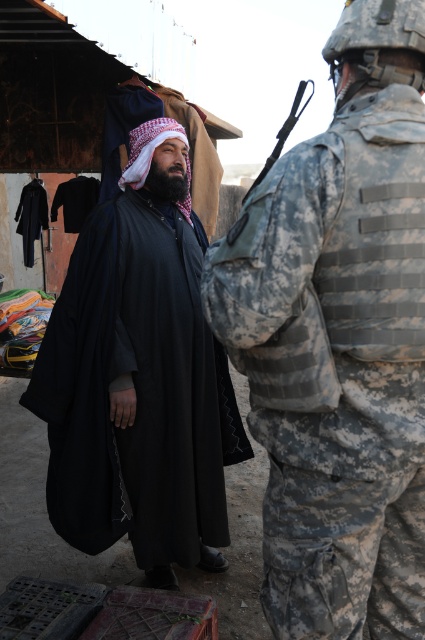
Question: Which of the following is the farthest from the observer?

Choices:
 (A) (368, 401)
 (B) (70, 522)

Answer: (B)

Question: Which of the following is the closest to the observer?

Choices:
 (A) black matte robe at center
 (B) camouflage uniform at right

Answer: (B)

Question: Is camouflage uniform at right to the right of black matte robe at center from the viewer's perspective?

Choices:
 (A) no
 (B) yes

Answer: (B)

Question: Can you confirm if camouflage uniform at right is positioned below black matte robe at center?

Choices:
 (A) yes
 (B) no

Answer: (B)

Question: Is camouflage uniform at right in front of black matte robe at center?

Choices:
 (A) yes
 (B) no

Answer: (A)

Question: Among these points, which one is farthest from the camera?

Choices:
 (A) (155, 452)
 (B) (235, 365)

Answer: (A)